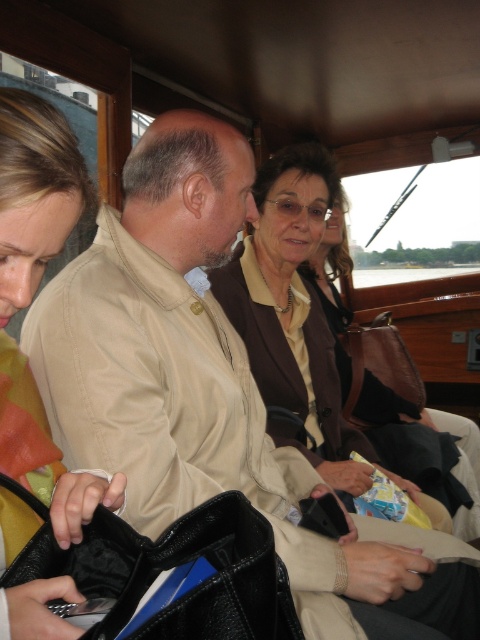
Does point (48, 148) lie in front of point (267, 566)?

No, it is not.

You are a GUI agent. You are given a task and a screenshot of the screen. Output one action in this format:
    pyautogui.click(x=<x>, y=<y>)
    Task: Click on the matte yellow jacket at left
    This screenshot has height=640, width=480.
    Given the screenshot: What is the action you would take?
    pyautogui.click(x=33, y=296)

Which is more to the right, matte yellow jacket at left or brown leather jacket at center?

Positioned to the right is brown leather jacket at center.

Can you confirm if matte yellow jacket at left is bigger than brown leather jacket at center?

Incorrect, matte yellow jacket at left is not larger than brown leather jacket at center.

You are a GUI agent. You are given a task and a screenshot of the screen. Output one action in this format:
    pyautogui.click(x=<x>, y=<y>)
    Task: Click on the matte yellow jacket at left
    The height and width of the screenshot is (640, 480).
    Given the screenshot: What is the action you would take?
    pyautogui.click(x=33, y=296)

Can you confirm if black leather bag at lower left is positioned to the right of brown leather jacket at center?

Incorrect, black leather bag at lower left is not on the right side of brown leather jacket at center.

Between black leather bag at lower left and brown leather jacket at center, which one appears on the right side from the viewer's perspective?

From the viewer's perspective, brown leather jacket at center appears more on the right side.

Which is behind, point (118, 612) or point (462, 428)?

Positioned behind is point (462, 428).

Locate an element on the screen. black leather bag at lower left is located at coordinates (170, 568).